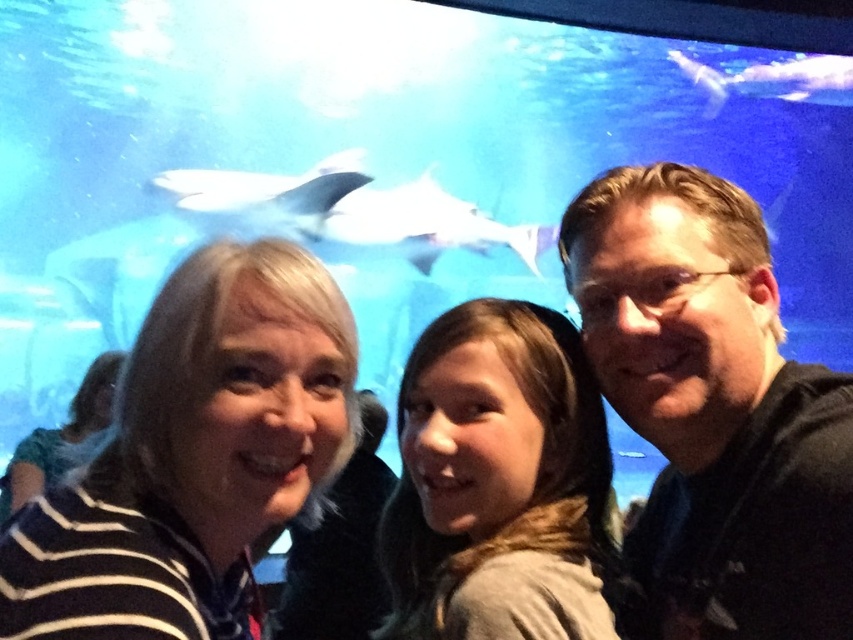
Question: Does black matte shirt at right have a greater width compared to striped fabric face at left?

Choices:
 (A) yes
 (B) no

Answer: (B)

Question: Is black matte shirt at right above white matte shark at upper center?

Choices:
 (A) yes
 (B) no

Answer: (B)

Question: Does black matte shirt at right have a larger size compared to brown fuzzy scarf at center?

Choices:
 (A) no
 (B) yes

Answer: (B)

Question: Which of these objects is positioned closest to the white glossy shark at upper center?

Choices:
 (A) striped fabric at left
 (B) black matte shirt at right
 (C) brown fuzzy scarf at center

Answer: (A)

Question: Among these points, which one is farthest from the camera?

Choices:
 (A) (254, 387)
 (B) (412, 250)
 (C) (33, 456)

Answer: (B)

Question: Which point is farther to the camera?

Choices:
 (A) brown fuzzy scarf at center
 (B) striped fabric face at left
 (C) white glossy shark at upper center
 (D) striped fabric at left

Answer: (C)